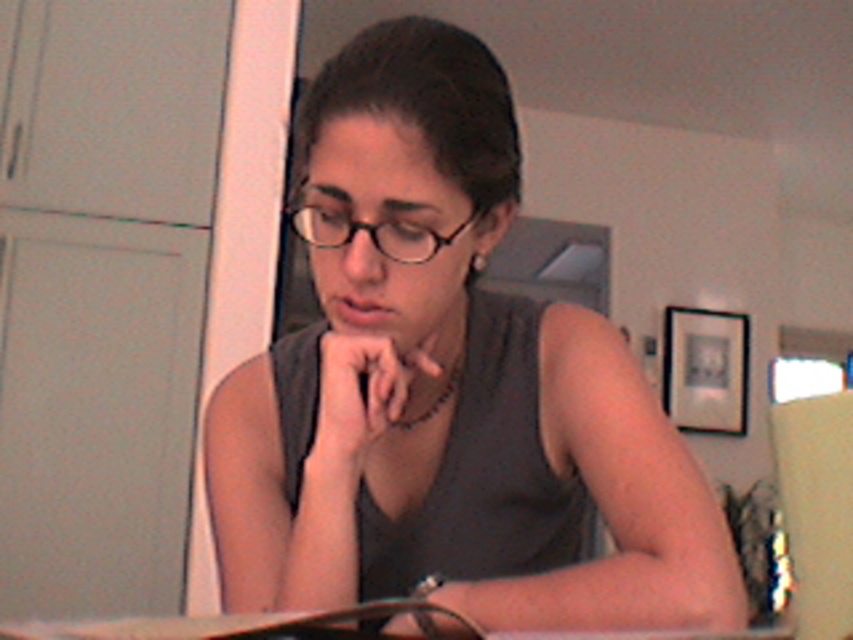
Between matte gray tank top at center and black plastic glasses at center, which one appears on the left side from the viewer's perspective?

black plastic glasses at center is more to the left.

Is point (416, 564) positioned before point (323, 221)?

No, (416, 564) is further to viewer.

The height and width of the screenshot is (640, 853). Find the location of `matte gray tank top at center`. matte gray tank top at center is located at coordinates (445, 388).